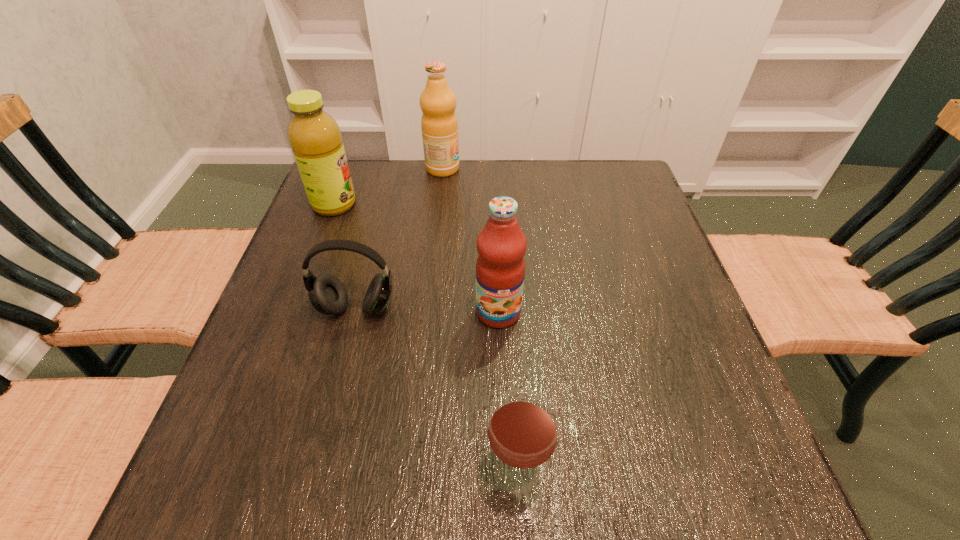
Locate an element on the screen. free space located on the ear cups of the headset is located at coordinates (338, 381).

Find the location of `vacant space situated on the left of the nearest object`. vacant space situated on the left of the nearest object is located at coordinates (447, 471).

Locate an element on the screen. This screenshot has width=960, height=540. object at the near edge is located at coordinates (523, 425).

Where is `fruit juice at the left edge`? fruit juice at the left edge is located at coordinates (315, 138).

You are a GUI agent. You are given a task and a screenshot of the screen. Output one action in this format:
    pyautogui.click(x=<x>, y=<y>)
    Task: Click on the headset present at the left edge
    
    Given the screenshot: What is the action you would take?
    pyautogui.click(x=327, y=294)

Identify the location of object present at the far left corner. (315, 138).

In the image, there is a desktop. Where is `vacant space at the far edge`? The height and width of the screenshot is (540, 960). vacant space at the far edge is located at coordinates (416, 179).

Image resolution: width=960 pixels, height=540 pixels. In order to click on free space at the right edge in this screenshot , I will do `click(633, 322)`.

Image resolution: width=960 pixels, height=540 pixels. I want to click on vacant space at the far right corner of the desktop, so click(600, 208).

Locate an element on the screen. This screenshot has width=960, height=540. unoccupied area between the headset and the nearest object is located at coordinates (437, 390).